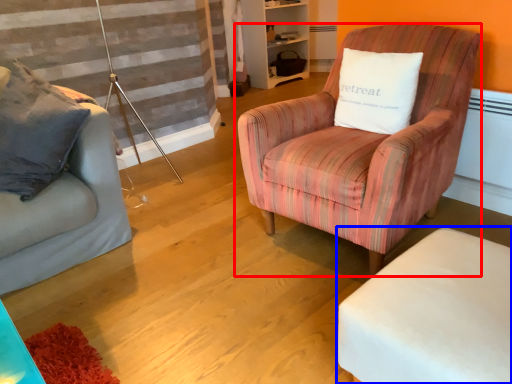
Question: Which object is further to the camera taking this photo, chair (highlighted by a red box) or table (highlighted by a blue box)?

Choices:
 (A) chair
 (B) table

Answer: (A)